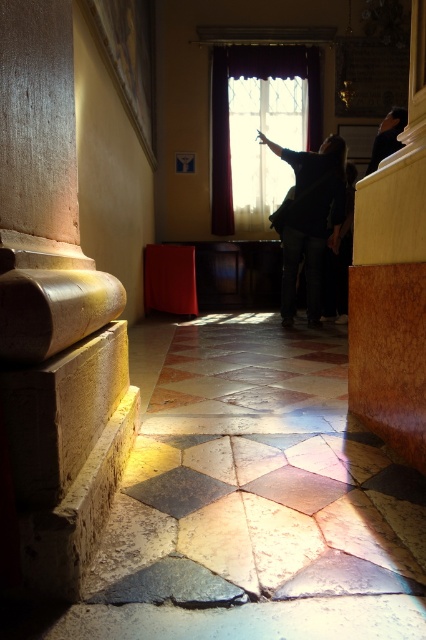
Can you confirm if dark fabric at center is wider than dark blue fabric at upper right?

Yes, dark fabric at center is wider than dark blue fabric at upper right.

Which is behind, point (275, 147) or point (388, 118)?

Point (275, 147)

This screenshot has width=426, height=640. What are the coordinates of `dark fabric at center` in the screenshot? It's located at (310, 220).

Between point (3, 198) and point (391, 128), which one is positioned in front?

Point (3, 198) is more forward.

Which of these two, polished stone column at left or dark blue fabric at upper right, stands taller?

With more height is polished stone column at left.

I want to click on polished stone column at left, so click(x=54, y=314).

Can you confirm if polished stone column at left is smaller than dark fabric at center?

Yes, polished stone column at left is smaller than dark fabric at center.

The width and height of the screenshot is (426, 640). I want to click on polished stone column at left, so click(54, 314).

Does point (48, 196) come closer to viewer compared to point (290, 305)?

Yes.

Where is `polished stone column at left`? This screenshot has width=426, height=640. polished stone column at left is located at coordinates pyautogui.click(x=54, y=314).